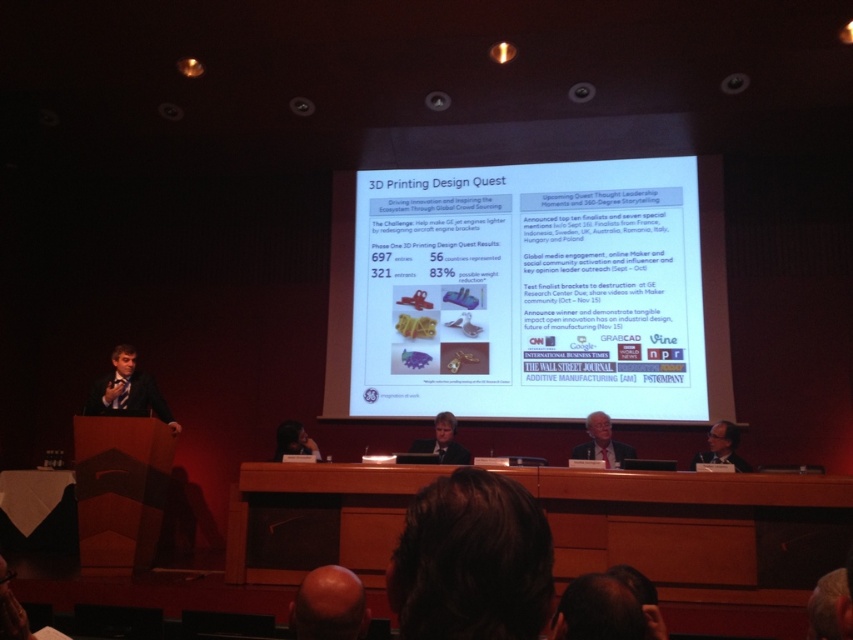
Is bald head at lower center to the left of smooth black suit at center from the viewer's perspective?

Correct, you'll find bald head at lower center to the left of smooth black suit at center.

Who is higher up, bald head at lower center or smooth black suit at center?

bald head at lower center

Does point (338, 572) lie in front of point (450, 417)?

Yes, it is in front of point (450, 417).

Where is `bald head at lower center`? bald head at lower center is located at coordinates (328, 605).

Consider the image. Who is positioned more to the left, dark suit at left or dark brown leather chair at lower center?

dark suit at left is more to the left.

This screenshot has height=640, width=853. What are the coordinates of `dark suit at left` in the screenshot? It's located at (126, 392).

Identify the location of dark suit at left. (126, 392).

Measure the distance from smooth black suit at center to matte black glasses at upper right.

smooth black suit at center and matte black glasses at upper right are 6.08 feet apart from each other.

Is smooth black suit at center above matte black glasses at upper right?

Yes.

Who is more distant from viewer, (x=438, y=449) or (x=747, y=468)?

The point (x=438, y=449) is more distant.

Find the location of a particular element. The image size is (853, 640). smooth black suit at center is located at coordinates (444, 442).